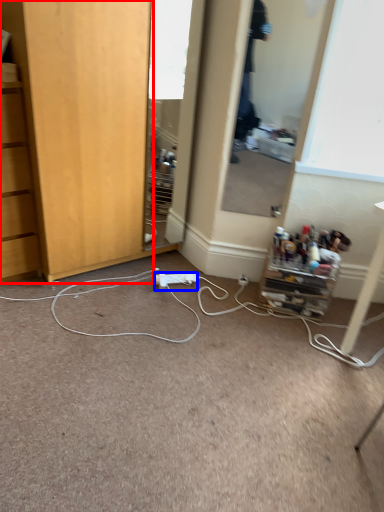
Question: Which point is further to the camera, cabinetry (highlighted by a red box) or power outlet (highlighted by a blue box)?

Choices:
 (A) cabinetry
 (B) power outlet

Answer: (B)